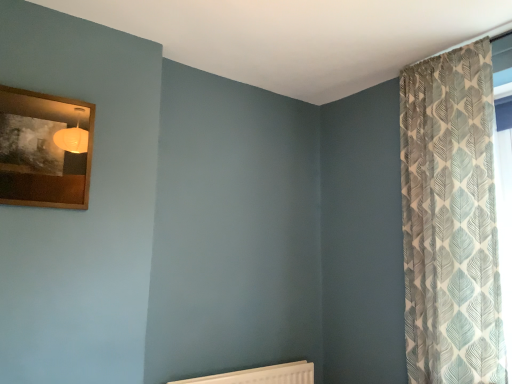
Identify the location of white textured radiator at lower center. (261, 375).

What is the approximate width of wooden picture frame at upper left?

1.91 inches.

What are the coordinates of `patterned fabric curtain at right` in the screenshot? It's located at (450, 220).

Find the location of a particular element. Image resolution: width=512 pixels, height=384 pixels. white textured radiator at lower center is located at coordinates (261, 375).

Considering the relative sizes of wooden picture frame at upper left and white textured radiator at lower center in the image provided, is wooden picture frame at upper left bigger than white textured radiator at lower center?

No, wooden picture frame at upper left is not bigger than white textured radiator at lower center.

Considering the sizes of wooden picture frame at upper left and white textured radiator at lower center in the image, is wooden picture frame at upper left taller or shorter than white textured radiator at lower center?

Considering their sizes, wooden picture frame at upper left has more height than white textured radiator at lower center.

From the image's perspective, which is below, wooden picture frame at upper left or white textured radiator at lower center?

white textured radiator at lower center appears lower in the image.

Is white textured radiator at lower center behind patterned fabric curtain at right?

Yes, the depth of white textured radiator at lower center is greater than that of patterned fabric curtain at right.

Between white textured radiator at lower center and patterned fabric curtain at right, which one has smaller width?

white textured radiator at lower center is thinner.

Between white textured radiator at lower center and patterned fabric curtain at right, which one appears on the right side from the viewer's perspective?

patterned fabric curtain at right is more to the right.

Considering the sizes of objects white textured radiator at lower center and patterned fabric curtain at right in the image provided, who is smaller, white textured radiator at lower center or patterned fabric curtain at right?

Smaller between the two is white textured radiator at lower center.

Considering the relative positions of white textured radiator at lower center and wooden picture frame at upper left in the image provided, is white textured radiator at lower center to the left of wooden picture frame at upper left from the viewer's perspective?

Incorrect, white textured radiator at lower center is not on the left side of wooden picture frame at upper left.

Would you say white textured radiator at lower center is a long distance from wooden picture frame at upper left?

That's right, there is a large distance between white textured radiator at lower center and wooden picture frame at upper left.

How different are the orientations of white textured radiator at lower center and wooden picture frame at upper left in degrees?

There is a 0.00231-degree angle between the facing directions of white textured radiator at lower center and wooden picture frame at upper left.

How much distance is there between white textured radiator at lower center and wooden picture frame at upper left?

They are 4.73 feet apart.

Is point (462, 280) farther from viewer compared to point (236, 379)?

No, (462, 280) is closer to viewer.

Considering the relative positions of patterned fabric curtain at right and white textured radiator at lower center in the image provided, is patterned fabric curtain at right behind white textured radiator at lower center?

No, it is in front of white textured radiator at lower center.

At what (x,y) coordinates should I click in order to perform the action: click on radiator below the patterned fabric curtain at right (from the image's perspective). Please return your answer as a coordinate pair (x, y). The image size is (512, 384). Looking at the image, I should click on (261, 375).

Measure the distance from patterned fabric curtain at right to white textured radiator at lower center.

A distance of 3.95 feet exists between patterned fabric curtain at right and white textured radiator at lower center.

In the image, is patterned fabric curtain at right positioned in front of or behind wooden picture frame at upper left?

Clearly, patterned fabric curtain at right is behind wooden picture frame at upper left.

Is patterned fabric curtain at right oriented away from wooden picture frame at upper left?

No, patterned fabric curtain at right is not facing away from wooden picture frame at upper left.

From a real-world perspective, who is located higher, patterned fabric curtain at right or wooden picture frame at upper left?

From a 3D spatial view, wooden picture frame at upper left is above.

Between patterned fabric curtain at right and wooden picture frame at upper left, which one has larger size?

Bigger between the two is patterned fabric curtain at right.

Is wooden picture frame at upper left facing away from patterned fabric curtain at right?

wooden picture frame at upper left is not turned away from patterned fabric curtain at right.

Where is `curtain behind the wooden picture frame at upper left`? The width and height of the screenshot is (512, 384). curtain behind the wooden picture frame at upper left is located at coordinates (450, 220).

From the picture: How different are the orientations of wooden picture frame at upper left and patterned fabric curtain at right in degrees?

87.4 degrees separate the facing orientations of wooden picture frame at upper left and patterned fabric curtain at right.

Is wooden picture frame at upper left not inside patterned fabric curtain at right?

Yes, wooden picture frame at upper left is not within patterned fabric curtain at right.

Where is `picture frame located above the white textured radiator at lower center (from the image's perspective)`? This screenshot has width=512, height=384. picture frame located above the white textured radiator at lower center (from the image's perspective) is located at coordinates (44, 150).

Locate an element on the screen. The width and height of the screenshot is (512, 384). radiator located below the patterned fabric curtain at right (from the image's perspective) is located at coordinates (261, 375).

Considering their positions, is wooden picture frame at upper left positioned closer to white textured radiator at lower center than patterned fabric curtain at right?

Based on the image, patterned fabric curtain at right appears to be nearer to white textured radiator at lower center.

Which object lies nearer to the anchor point patterned fabric curtain at right, white textured radiator at lower center or wooden picture frame at upper left?

Among the two, white textured radiator at lower center is located nearer to patterned fabric curtain at right.

From the image, which object appears to be farther from wooden picture frame at upper left, patterned fabric curtain at right or white textured radiator at lower center?

patterned fabric curtain at right is positioned further to the anchor wooden picture frame at upper left.

Which object lies further to the anchor point white textured radiator at lower center, patterned fabric curtain at right or wooden picture frame at upper left?

wooden picture frame at upper left is positioned further to the anchor white textured radiator at lower center.

Estimate the real-world distances between objects in this image. Which object is further from wooden picture frame at upper left, white textured radiator at lower center or patterned fabric curtain at right?

patterned fabric curtain at right.

Looking at the image, which one is located further to patterned fabric curtain at right, wooden picture frame at upper left or white textured radiator at lower center?

wooden picture frame at upper left lies further to patterned fabric curtain at right than the other object.

Identify the location of radiator between wooden picture frame at upper left and patterned fabric curtain at right. (261, 375).